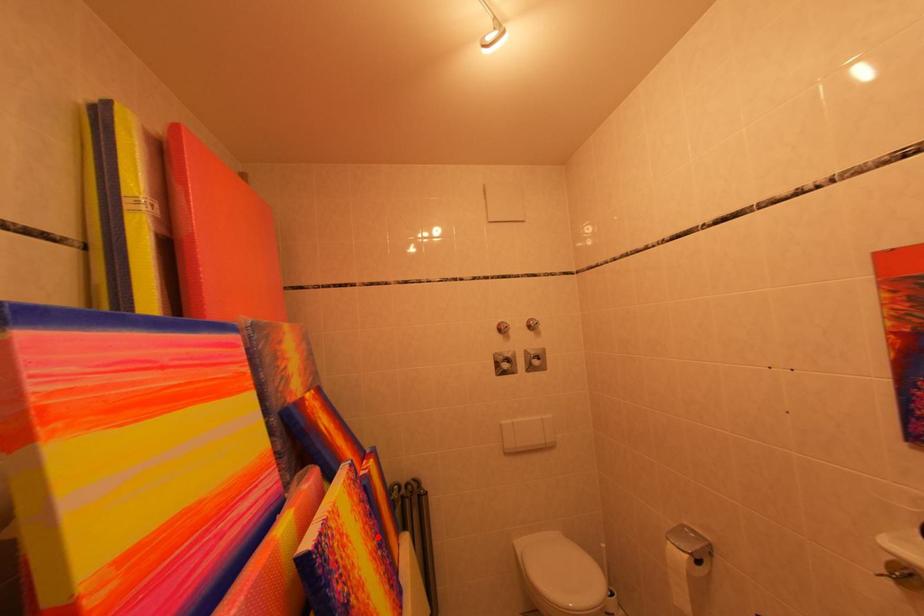
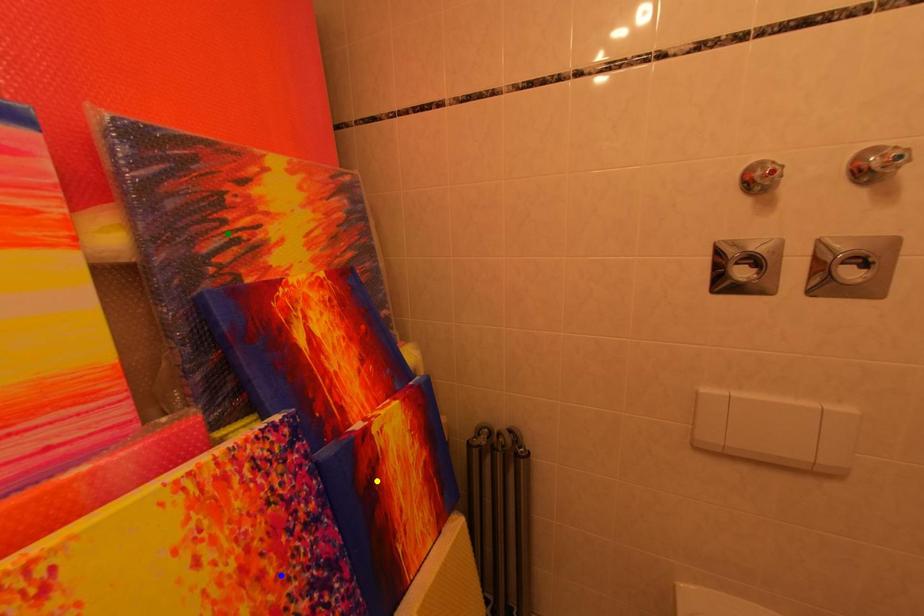
Question: I am providing you with two images of the same scene from different viewpoints. A red point is marked on the first image. You are given multiple points on the second image. Which spot in image 2 lines up with the point in image 1?

Choices:
 (A) yellow point
 (B) blue point
 (C) green point

Answer: (B)